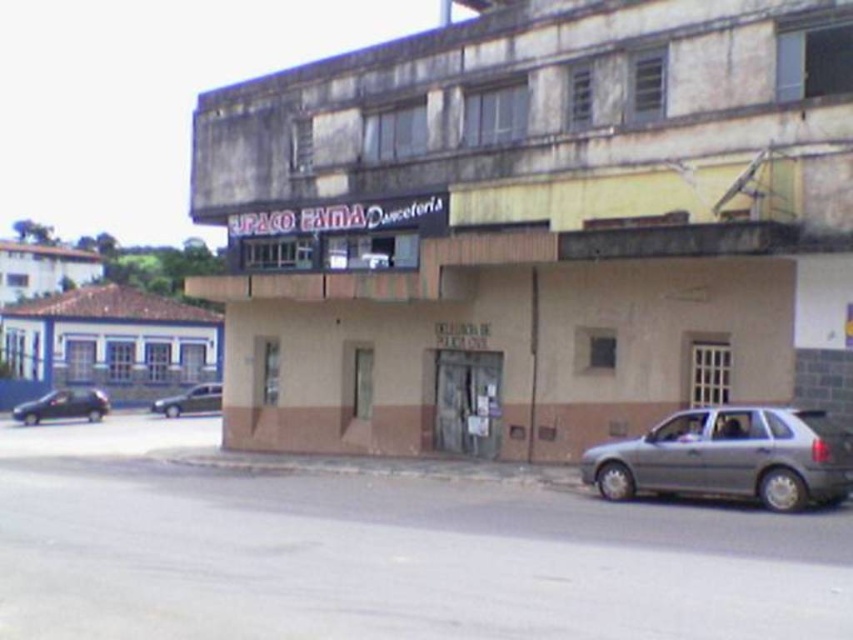
Which is in front, point (50, 403) or point (215, 408)?

Point (50, 403) is more forward.

Where is `shiny black sedan at lower left`? shiny black sedan at lower left is located at coordinates (62, 404).

Is point (86, 394) farther from viewer compared to point (169, 406)?

That is False.

Where is `shiny black sedan at lower left`? Image resolution: width=853 pixels, height=640 pixels. shiny black sedan at lower left is located at coordinates (62, 404).

Where is `satin silver hatchback at lower right`? The height and width of the screenshot is (640, 853). satin silver hatchback at lower right is located at coordinates (730, 458).

Which is above, satin silver hatchback at lower right or shiny black sedan at lower left?

satin silver hatchback at lower right is higher up.

Does point (764, 468) lie behind point (39, 412)?

No, it is in front of (39, 412).

Locate an element on the screen. This screenshot has width=853, height=640. satin silver hatchback at lower right is located at coordinates point(730,458).

Based on the photo, can you confirm if satin silver hatchback at lower right is positioned below metallic silver sedan at lower left?

No.

Is satin silver hatchback at lower right wider than metallic silver sedan at lower left?

In fact, satin silver hatchback at lower right might be narrower than metallic silver sedan at lower left.

Measure the distance between point (x=689, y=420) and camera.

Point (x=689, y=420) is 15.63 meters away from camera.

Find the location of a particular element. satin silver hatchback at lower right is located at coordinates (730, 458).